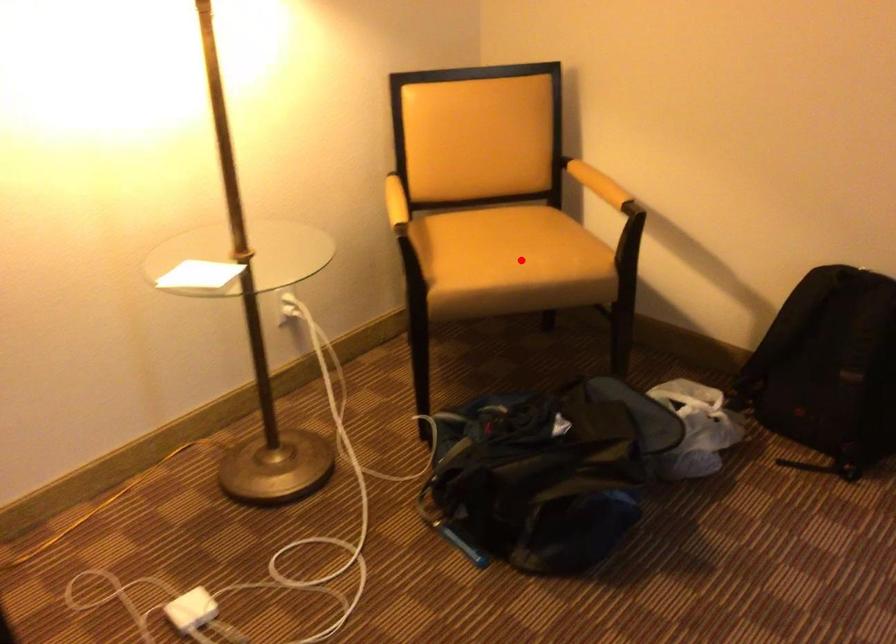
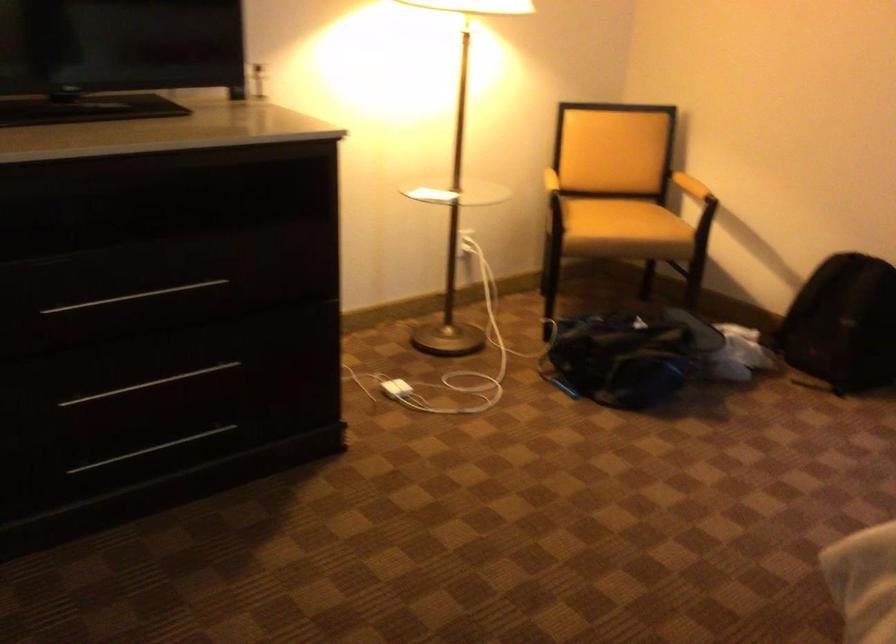
Locate, in the second image, the point that corresponds to the highlighted location in the first image.

(623, 220)